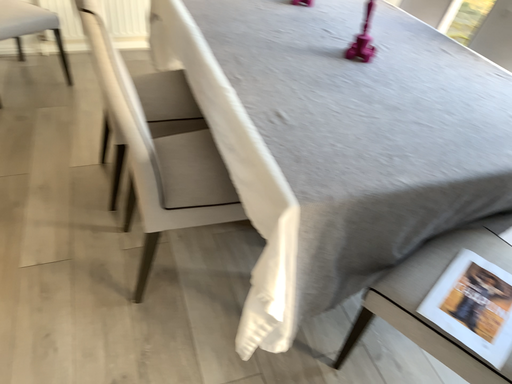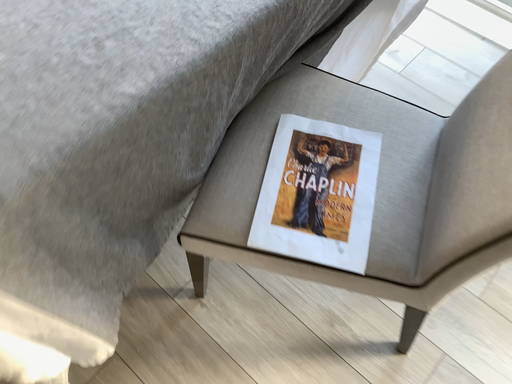
Question: Which way did the camera rotate in the video?

Choices:
 (A) rotated downward
 (B) rotated upward

Answer: (A)